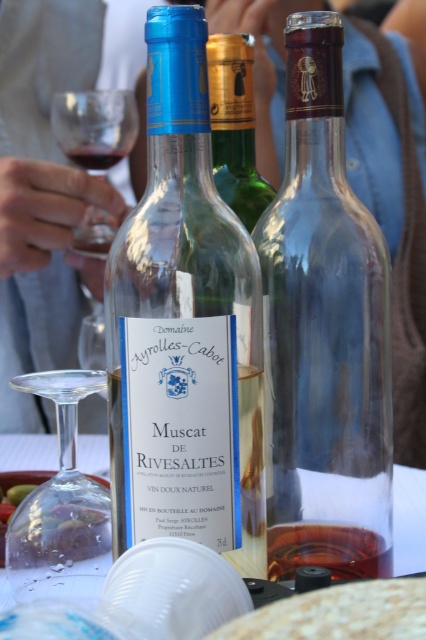
You are arranging wine bottles on a narrow shelf that can only accommodate items up to 12 centimeters in width. You have a transparent glass bottle at center and a green glass bottle at center. Which bottle should you choose to fit on the shelf?

The green glass bottle at center has a smaller width than the transparent glass bottle at center, so it will fit on the shelf better.

You are at a party and see a white plastic cup at center and an amber liquid at bottle right. If you want to pour the amber liquid into the cup, which direction should you move the cup to align it with the bottle?

The white plastic cup at center is to the left of the amber liquid at bottle right. To align the cup with the bottle, you should move the cup to the right.